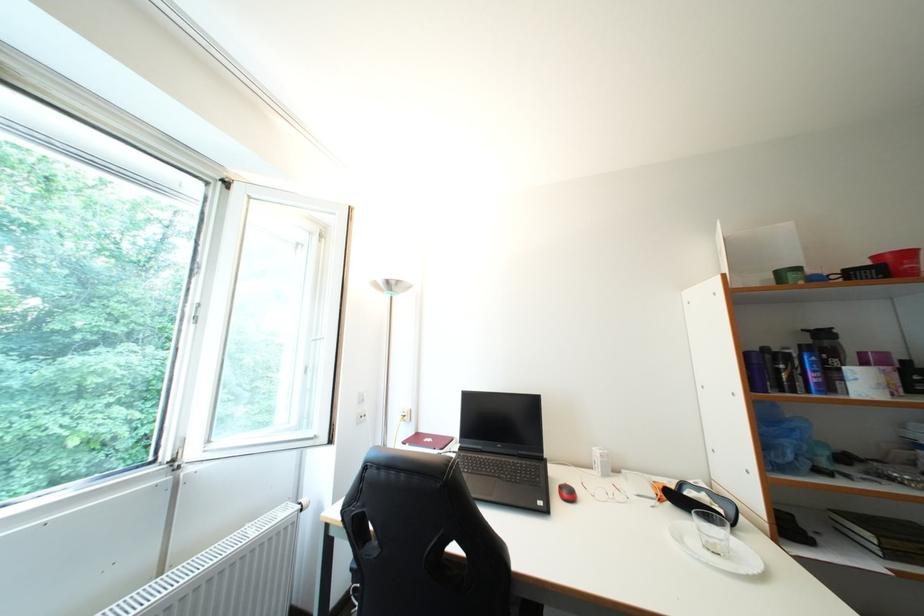
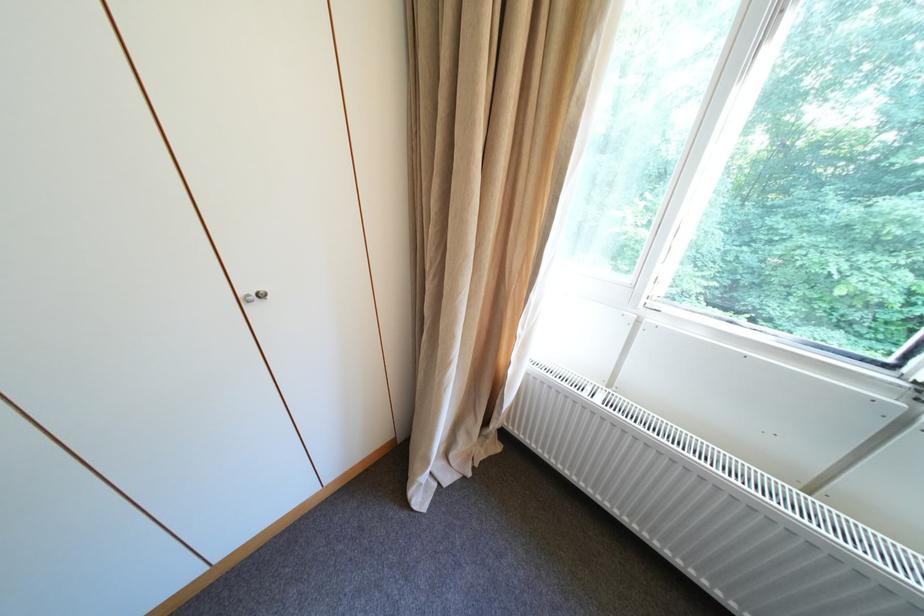
The first image is from the beginning of the video and the second image is from the end. How did the camera likely rotate when shooting the video?

The camera rotated toward left-down.